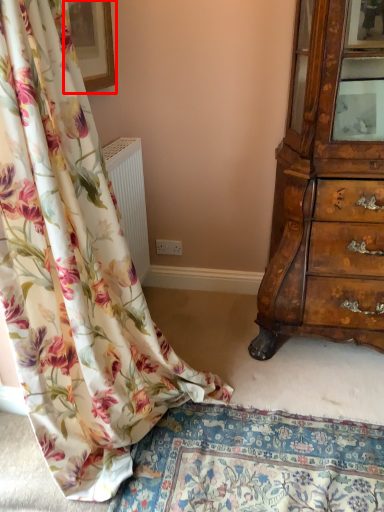
Question: From the image's perspective, what is the correct spatial relationship of picture frame (annotated by the red box) in relation to curtain?

Choices:
 (A) below
 (B) above

Answer: (B)